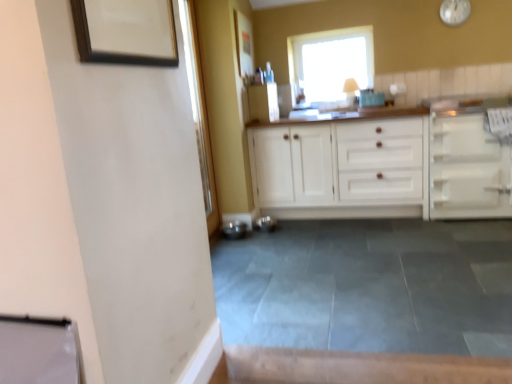
Question: Is wooden picture frame at upper left, the second picture frame viewed from the back, thinner than gray tile floor at center?

Choices:
 (A) no
 (B) yes

Answer: (B)

Question: Considering the relative positions of wooden picture frame at upper left, positioned as the second picture frame in top-to-bottom order, and gray tile floor at center in the image provided, is wooden picture frame at upper left, positioned as the second picture frame in top-to-bottom order, to the left of gray tile floor at center from the viewer's perspective?

Choices:
 (A) yes
 (B) no

Answer: (A)

Question: From a real-world perspective, is wooden picture frame at upper left, placed as the first picture frame when sorted from front to back, located higher than gray tile floor at center?

Choices:
 (A) yes
 (B) no

Answer: (A)

Question: Is wooden picture frame at upper left, the 1th picture frame from the bottom, directly adjacent to gray tile floor at center?

Choices:
 (A) yes
 (B) no

Answer: (B)

Question: From the image's perspective, is wooden picture frame at upper left, the 1th picture frame from the bottom, below gray tile floor at center?

Choices:
 (A) no
 (B) yes

Answer: (A)

Question: From a real-world perspective, is wooden picture frame at upper left, placed as the first picture frame when sorted from front to back, located beneath gray tile floor at center?

Choices:
 (A) yes
 (B) no

Answer: (B)

Question: Considering the relative sizes of white matte cabinet at right, the 1th cabinetry from the right, and matte wooden picture frame at upper center, which ranks as the 2th picture frame in bottom-to-top order, in the image provided, is white matte cabinet at right, the 1th cabinetry from the right, thinner than matte wooden picture frame at upper center, which ranks as the 2th picture frame in bottom-to-top order,?

Choices:
 (A) yes
 (B) no

Answer: (B)

Question: Can you confirm if white matte cabinet at right, which is the 2th cabinetry in left-to-right order, is bigger than matte wooden picture frame at upper center, the second picture frame from the left?

Choices:
 (A) yes
 (B) no

Answer: (A)

Question: Can you confirm if white matte cabinet at right, which is the 2th cabinetry in left-to-right order, is wider than matte wooden picture frame at upper center, arranged as the 1th picture frame when viewed from the top?

Choices:
 (A) no
 (B) yes

Answer: (B)

Question: Are white matte cabinet at right, the 1th cabinetry from the right, and matte wooden picture frame at upper center, which is the first picture frame from back to front, located far from each other?

Choices:
 (A) no
 (B) yes

Answer: (B)

Question: Is matte wooden picture frame at upper center, the second picture frame from the left, inside white matte cabinet at right, the 1th cabinetry from the right?

Choices:
 (A) no
 (B) yes

Answer: (A)

Question: Does white matte cabinet at right, the 1th cabinetry from the right, have a greater height compared to matte wooden picture frame at upper center, which is the 1th picture frame from right to left?

Choices:
 (A) yes
 (B) no

Answer: (A)

Question: Is matte wooden picture frame at upper center, arranged as the 1th picture frame when viewed from the top, completely or partially outside of white glossy clock at upper right?

Choices:
 (A) yes
 (B) no

Answer: (A)